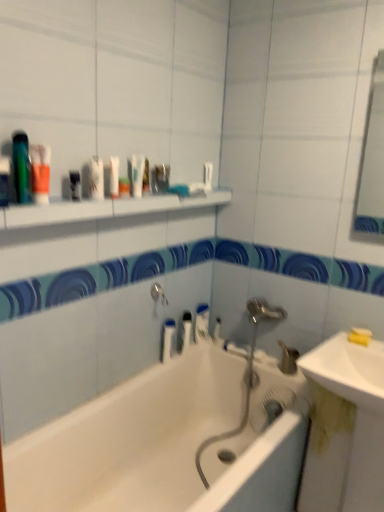
Identify the location of free space in front of white glossy soap at center, the second toiletry in the front-to-back sequence. The image size is (384, 512). (229, 350).